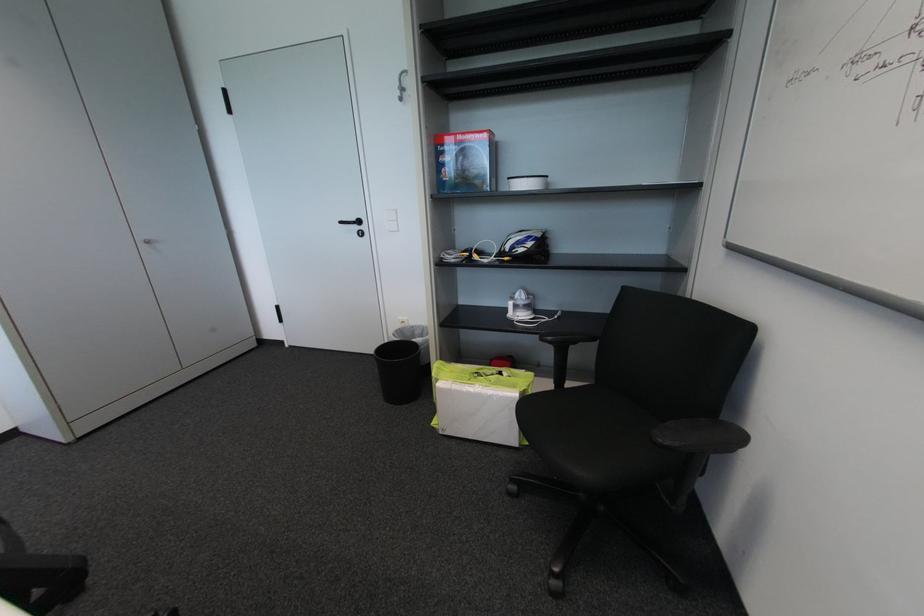
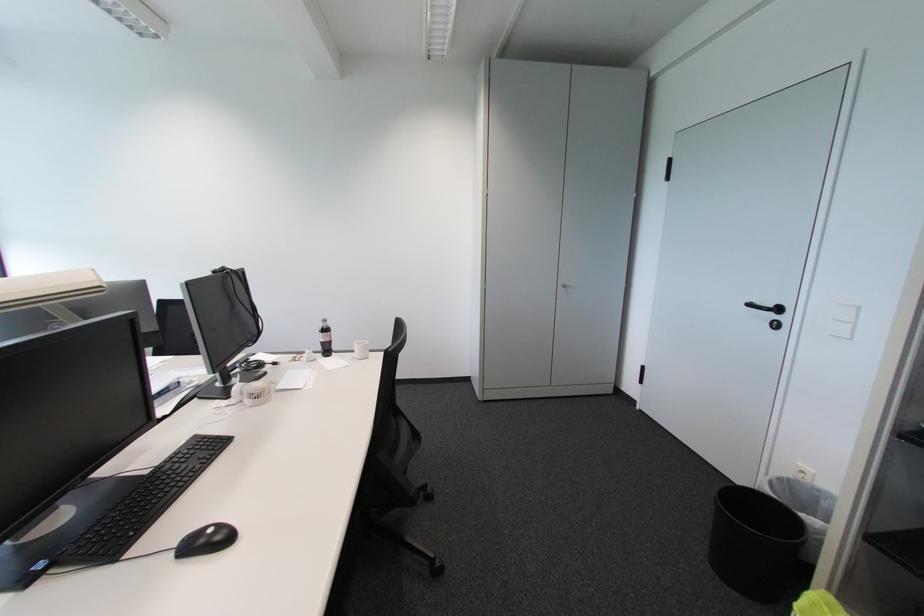
Find the pixel in the second image that matches [151,246] in the first image.

(567, 290)